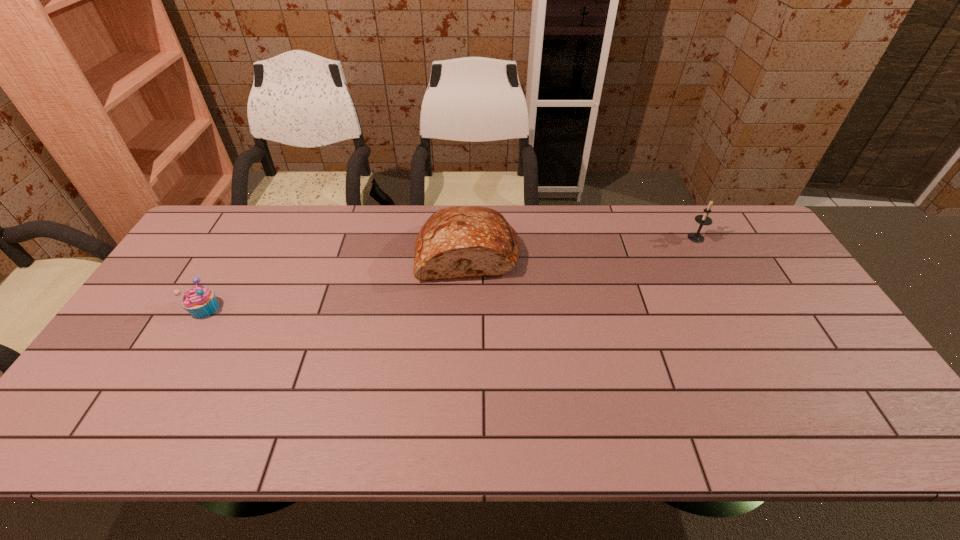
Where is `free space at the far edge`? free space at the far edge is located at coordinates (512, 220).

Find the location of `vacant space at the near edge of the desktop`. vacant space at the near edge of the desktop is located at coordinates (346, 421).

Where is `vacant space at the left edge of the desktop`? vacant space at the left edge of the desktop is located at coordinates (150, 306).

You are a GUI agent. You are given a task and a screenshot of the screen. Output one action in this format:
    pyautogui.click(x=<x>, y=<y>)
    Task: Click on the free location at the right edge of the desktop
    This screenshot has width=960, height=540.
    Given the screenshot: What is the action you would take?
    coord(817,393)

Locate an element on the screen. This screenshot has width=960, height=540. vacant space at the far right corner of the desktop is located at coordinates (740, 238).

Identify the location of free space between the second object from left to right and the muffin. click(336, 280).

You are a GUI agent. You are given a task and a screenshot of the screen. Output one action in this format:
    pyautogui.click(x=<x>, y=<y>)
    Task: Click on the vacant space in between the rightmost object and the bread
    Image resolution: width=960 pixels, height=540 pixels.
    Given the screenshot: What is the action you would take?
    pyautogui.click(x=582, y=245)

You are a GUI agent. You are given a task and a screenshot of the screen. Output one action in this format:
    pyautogui.click(x=<x>, y=<y>)
    Task: Click on the vacant area that lies between the rightmost object and the bread
    The height and width of the screenshot is (540, 960).
    Given the screenshot: What is the action you would take?
    pyautogui.click(x=582, y=245)

Find the location of `vacant space in between the bread and the rightmost object`. vacant space in between the bread and the rightmost object is located at coordinates (582, 245).

Where is `vacant area that lies between the shortest object and the second object from right to left`? This screenshot has height=540, width=960. vacant area that lies between the shortest object and the second object from right to left is located at coordinates (336, 280).